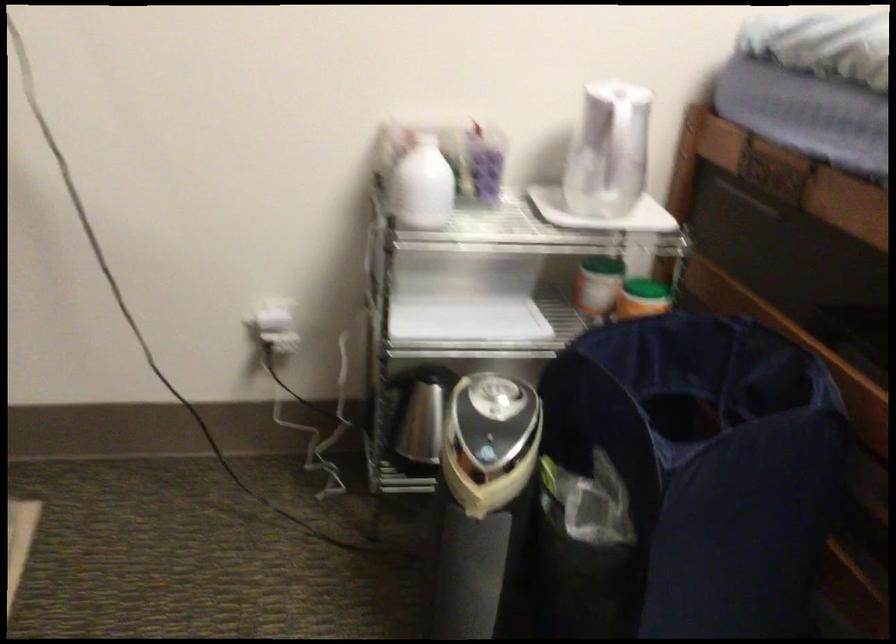
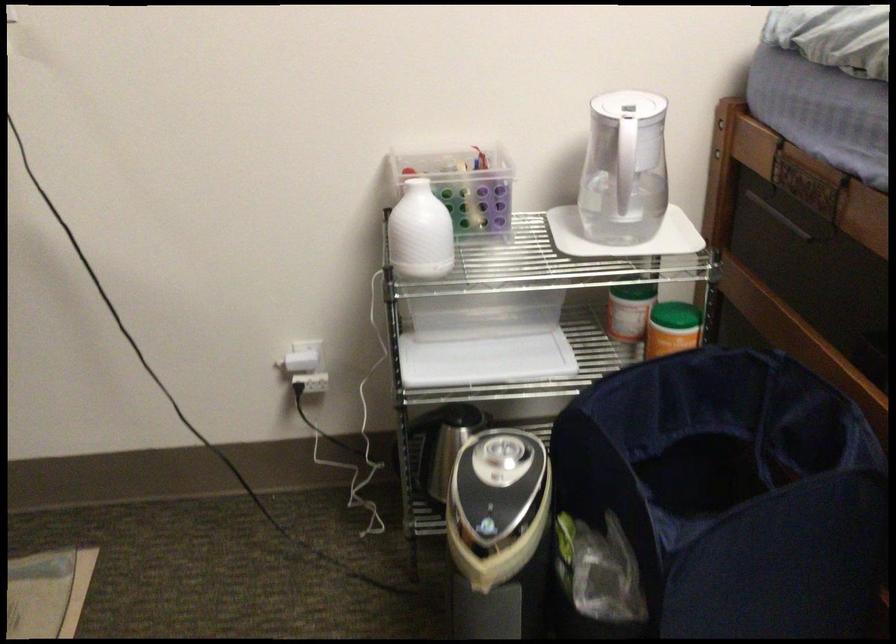
In the second image, find the point that corresponds to the point at 624,122 in the first image.

(630, 144)